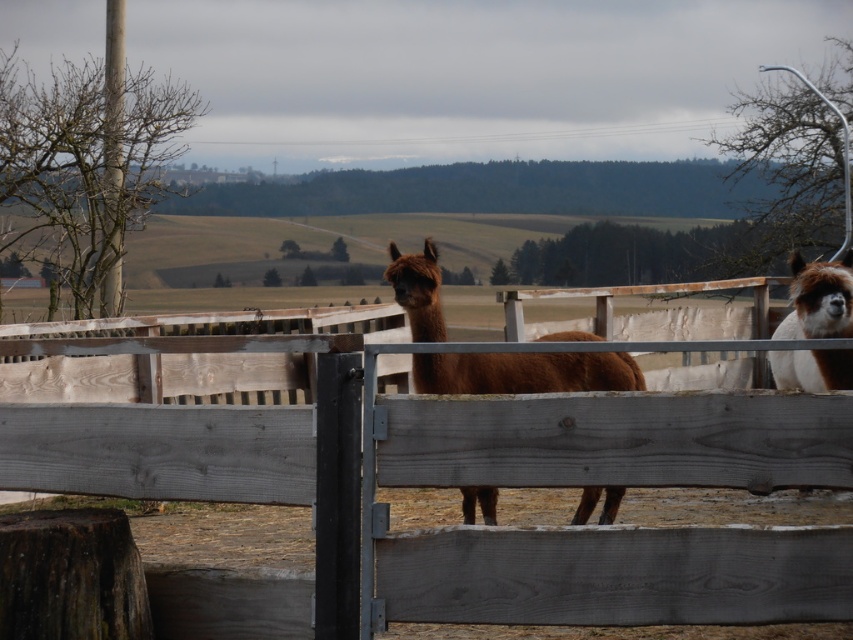
You are a farmer checking on your alpacas. You see the brown woolly alpaca at center and the brown woolly alpaca at right. Which one is positioned higher in the image?

The brown woolly alpaca at center is positioned higher in the image than the brown woolly alpaca at right.

You are a farmer who needs to ensure the brown woolly alpaca at center can pass through a gap in the brown wooden fence at center. Based on their sizes, do you think the alpaca can fit through the gap?

The brown wooden fence at center is wider than the brown woolly alpaca at center, so the gap between the fence planks is likely wide enough for the alpaca to pass through.

You are standing at the point marked by the coordinates point (428,467) in the image. What object are you directly facing?

The point (428,467) marks the brown wooden fence at center, so you are directly facing the brown wooden fence at center.